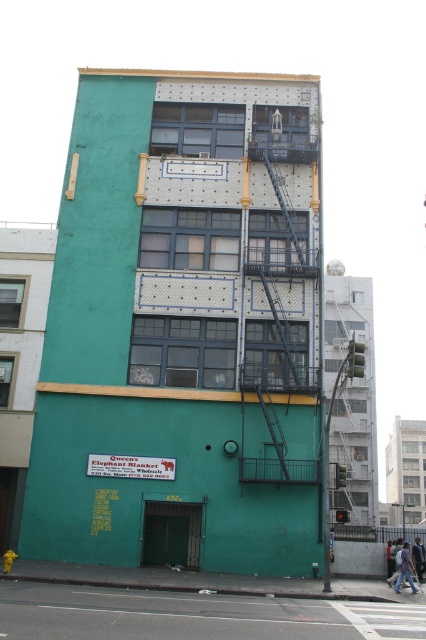
Who is positioned more to the right, teal matte building at center or black metal fire escape at center?

black metal fire escape at center

This screenshot has height=640, width=426. What do you see at coordinates (184, 328) in the screenshot?
I see `teal matte building at center` at bounding box center [184, 328].

At what (x,y) coordinates should I click in order to perform the action: click on teal matte building at center. Please return your answer as a coordinate pair (x, y). This screenshot has height=640, width=426. Looking at the image, I should click on (184, 328).